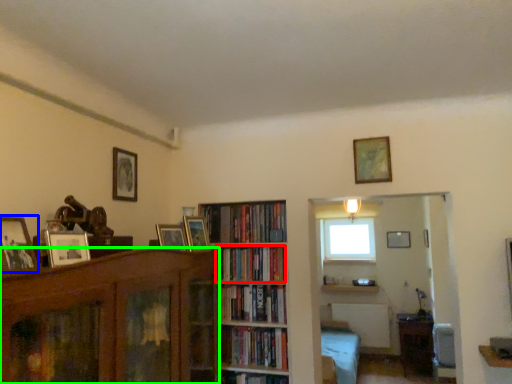
Question: Considering the real-world distances, which object is closest to book (highlighted by a red box)? picture frame (highlighted by a blue box) or bookcase (highlighted by a green box).

Choices:
 (A) picture frame
 (B) bookcase

Answer: (B)